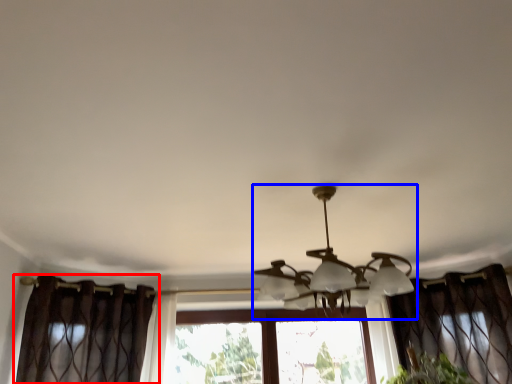
Question: Which of the following is the farthest to the observer, curtain (highlighted by a red box) or lamp (highlighted by a blue box)?

Choices:
 (A) curtain
 (B) lamp

Answer: (A)